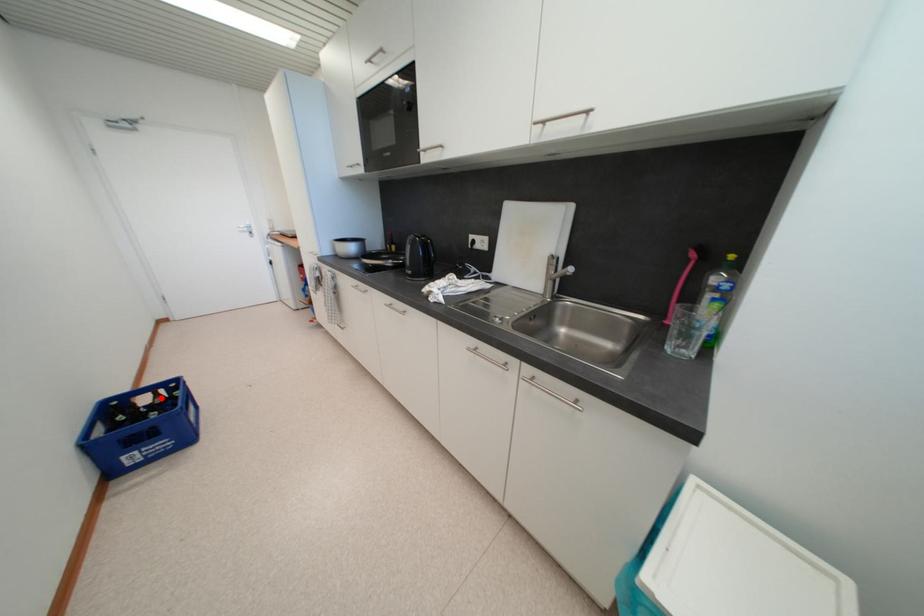
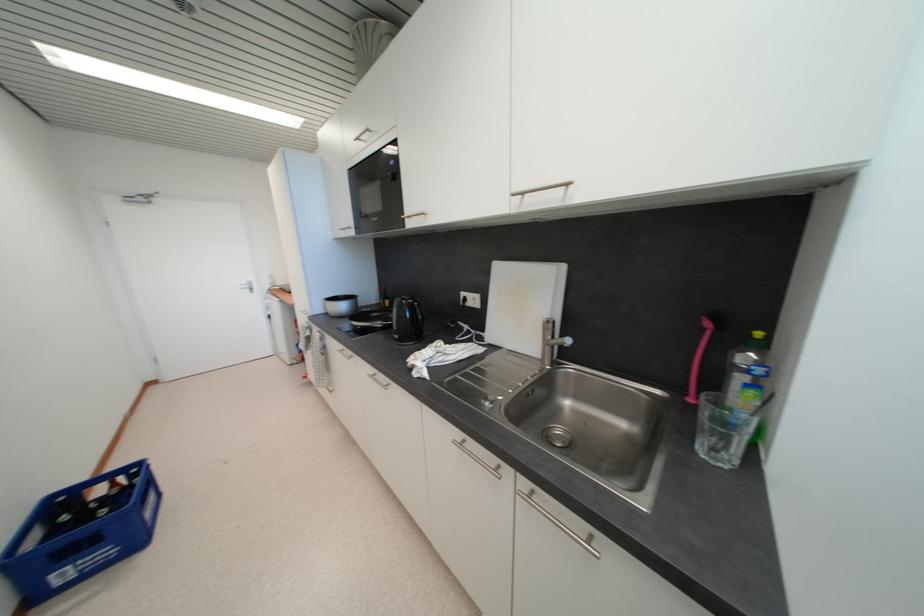
In the second image, find the point that corresponds to the highlighted location in the first image.

(118, 487)